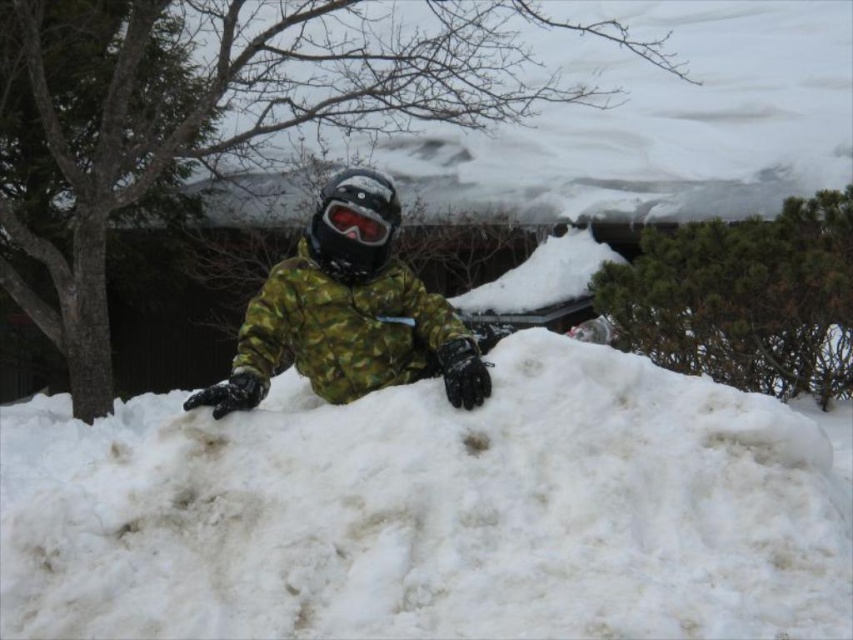
Question: From the image, what is the correct spatial relationship of white fluffy snow at center in relation to camo fabric jacket at center?

Choices:
 (A) below
 (B) above

Answer: (A)

Question: Which object is the farthest from the white fluffy snow at center?

Choices:
 (A) matte black goggles at center
 (B) camo fabric jacket at center

Answer: (A)

Question: Where is camo fabric jacket at center located in relation to matte black goggles at center in the image?

Choices:
 (A) left
 (B) right

Answer: (A)

Question: Which point is closer to the camera?

Choices:
 (A) camo fabric jacket at center
 (B) white fluffy snow at center

Answer: (B)

Question: Does white fluffy snow at center have a smaller size compared to matte black goggles at center?

Choices:
 (A) yes
 (B) no

Answer: (B)

Question: Which of the following is the farthest from the observer?

Choices:
 (A) (152, 630)
 (B) (345, 294)
 (C) (323, 202)

Answer: (B)